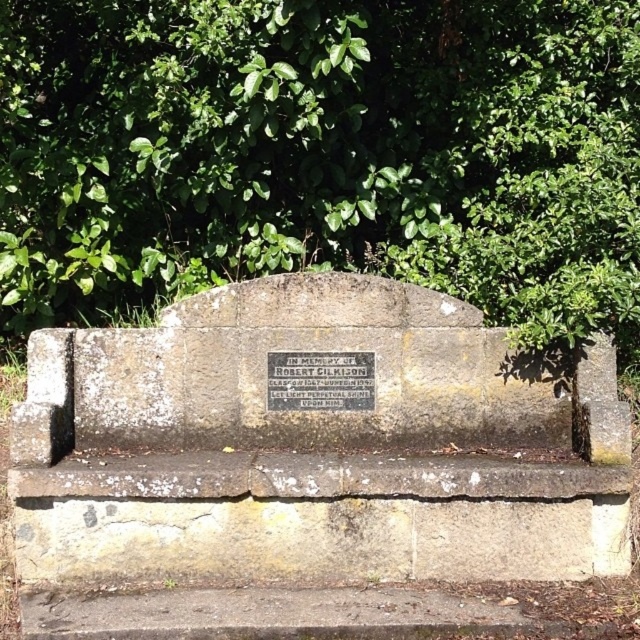
From the picture: Is the position of green leafy tree at upper center less distant than that of weathered stone bench at center?

No, green leafy tree at upper center is further to the viewer.

Can you confirm if green leafy tree at upper center is positioned to the right of weathered stone bench at center?

Incorrect, green leafy tree at upper center is not on the right side of weathered stone bench at center.

Locate an element on the screen. Image resolution: width=640 pixels, height=640 pixels. green leafy tree at upper center is located at coordinates (323, 156).

Can you confirm if weathered stone bench at center is taller than silver metallic plaque at center?

Yes, weathered stone bench at center is taller than silver metallic plaque at center.

Is weathered stone bench at center to the right of silver metallic plaque at center from the viewer's perspective?

Indeed, weathered stone bench at center is positioned on the right side of silver metallic plaque at center.

Between point (538, 490) and point (333, 396), which one is positioned behind?

The point (333, 396) is behind.

Identify the location of weathered stone bench at center. (312, 448).

Can you confirm if green leafy tree at upper center is positioned above silver metallic plaque at center?

Yes.

Between green leafy tree at upper center and silver metallic plaque at center, which one has less height?

silver metallic plaque at center

Is point (358, 81) farther from viewer compared to point (298, 385)?

That is True.

Identify the location of green leafy tree at upper center. (323, 156).